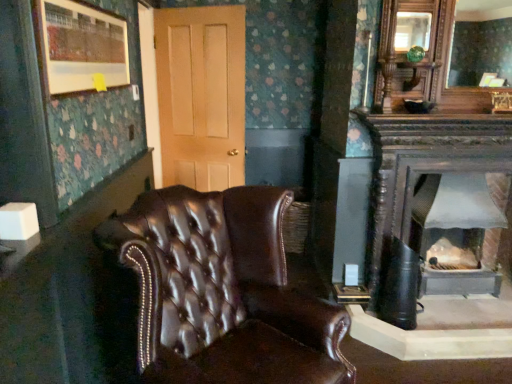
Question: Is point (467, 200) positioned closer to the camera than point (482, 59)?

Choices:
 (A) closer
 (B) farther

Answer: (A)

Question: Considering the positions of gray metallic wood burning stove at right and matte wooden mirror at upper right in the image, is gray metallic wood burning stove at right bigger or smaller than matte wooden mirror at upper right?

Choices:
 (A) big
 (B) small

Answer: (A)

Question: Estimate the real-world distances between objects in this image. Which object is closer to the brown leather chair at center?

Choices:
 (A) light brown wood door at center
 (B) gray metallic wood burning stove at right
 (C) matte wooden picture frame at upper left
 (D) matte wooden mirror at upper right

Answer: (C)

Question: Estimate the real-world distances between objects in this image. Which object is farther from the matte wooden mirror at upper right?

Choices:
 (A) matte wooden picture frame at upper left
 (B) brown leather chair at center
 (C) light brown wood door at center
 (D) gray metallic wood burning stove at right

Answer: (B)